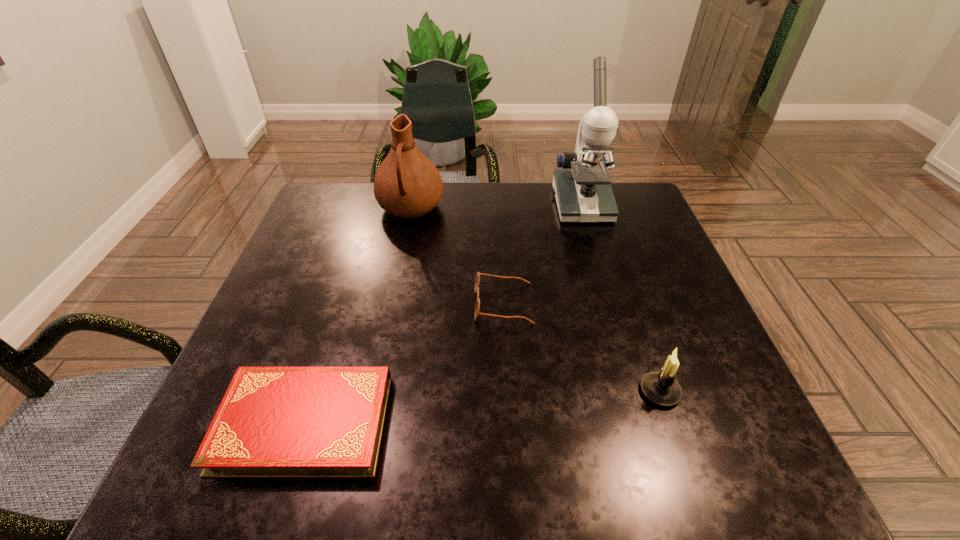
Find the location of a particular element. object that is at the far right corner is located at coordinates (583, 192).

You are a GUI agent. You are given a task and a screenshot of the screen. Output one action in this format:
    pyautogui.click(x=<x>, y=<y>)
    Task: Click on the vacant space at the far edge
    Image resolution: width=960 pixels, height=540 pixels.
    Given the screenshot: What is the action you would take?
    pyautogui.click(x=546, y=184)

Locate an element on the screen. The width and height of the screenshot is (960, 540). vacant space at the left edge of the desktop is located at coordinates (297, 366).

Where is `vacant space at the right edge`? The width and height of the screenshot is (960, 540). vacant space at the right edge is located at coordinates (666, 255).

I want to click on free space at the far right corner of the desktop, so click(x=632, y=199).

Where is `vacant space at the near right corner of the desktop`? vacant space at the near right corner of the desktop is located at coordinates pos(683,453).

This screenshot has width=960, height=540. I want to click on free spot between the second tallest object and the hardback book, so 357,315.

Find the location of `free space between the tallest object and the pitcher`. free space between the tallest object and the pitcher is located at coordinates (496, 206).

Find the location of a particular element. The image size is (960, 540). vacant region between the microscope and the third shortest object is located at coordinates (620, 298).

This screenshot has height=540, width=960. I want to click on empty space between the pitcher and the third nearest object, so click(457, 256).